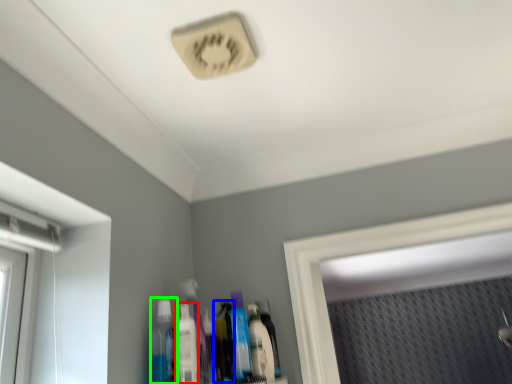
Question: Which is nearer to the mouthwash (highlighted by a red box)? toiletry (highlighted by a blue box) or mouthwash (highlighted by a green box).

Choices:
 (A) toiletry
 (B) mouthwash

Answer: (B)